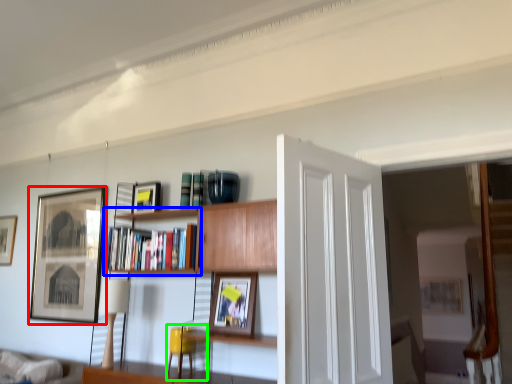
Question: Considering the real-world distances, which object is farthest from picture frame (highlighted by a red box)? shelf (highlighted by a blue box) or swivel chair (highlighted by a green box)?

Choices:
 (A) shelf
 (B) swivel chair

Answer: (B)